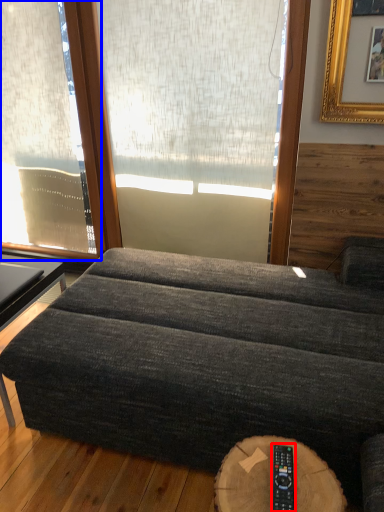
Question: Which of the following is the closest to the observer, remote (highlighted by a red box) or window (highlighted by a blue box)?

Choices:
 (A) remote
 (B) window

Answer: (A)